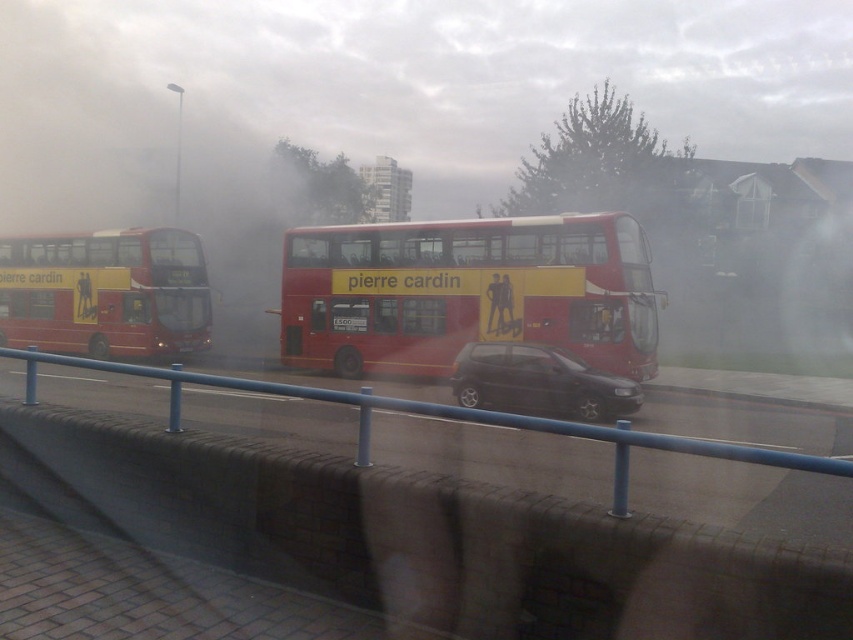
Question: Considering the relative positions of red matte double-decker bus at center and shiny black hatchback at center in the image provided, where is red matte double-decker bus at center located with respect to shiny black hatchback at center?

Choices:
 (A) left
 (B) right

Answer: (A)

Question: Which point appears farthest from the camera in this image?

Choices:
 (A) (351, 248)
 (B) (497, 440)

Answer: (A)

Question: Estimate the real-world distances between objects in this image. Which object is farther from the shiny black hatchback at center?

Choices:
 (A) matte red bus at left
 (B) blue metal rail at center

Answer: (A)

Question: Does red matte double-decker bus at center appear on the right side of blue metal rail at center?

Choices:
 (A) no
 (B) yes

Answer: (B)

Question: From the image, what is the correct spatial relationship of blue metal rail at center in relation to matte red bus at left?

Choices:
 (A) above
 (B) below

Answer: (B)

Question: Which of the following is the farthest from the observer?

Choices:
 (A) shiny black hatchback at center
 (B) blue metal rail at center
 (C) red matte double-decker bus at center
 (D) matte red bus at left

Answer: (D)